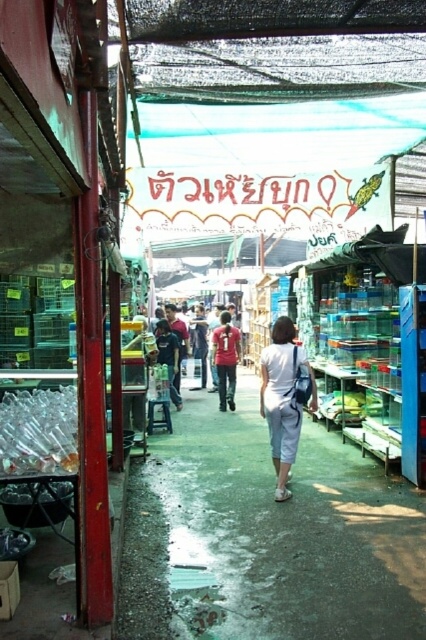
You are a customer at the market and want to buy both the white cotton pants at center and the red matte shirt at center. The vendor says they are placed in a specific order. Can you tell me which item is to the right of the other?

The white cotton pants at center is positioned on the right side of red matte shirt at center, so the white cotton pants at center is to the right of the red matte shirt at center.